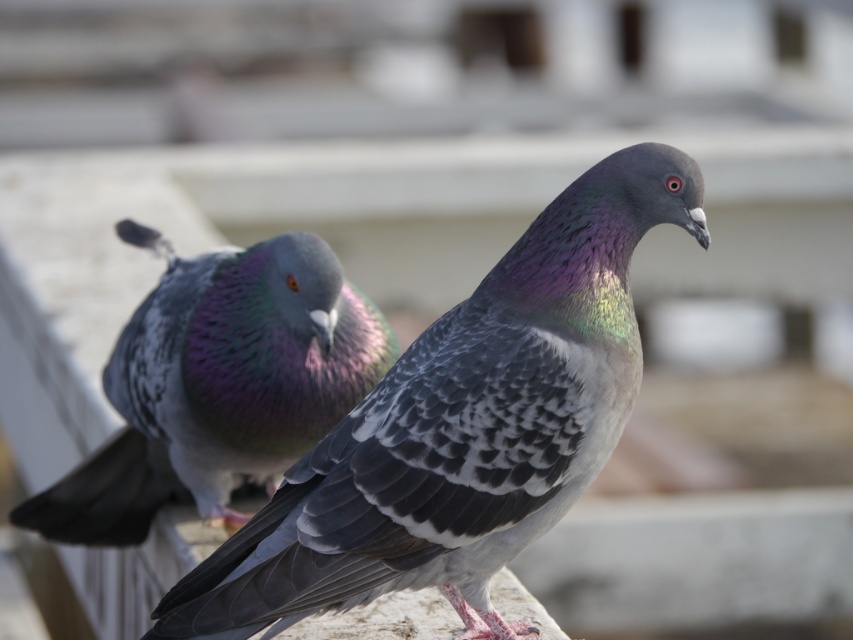
Question: Can you confirm if shiny iridescent pigeon at center is thinner than shiny iridescent feathers at center?

Choices:
 (A) no
 (B) yes

Answer: (B)

Question: Is shiny iridescent pigeon at center further to the viewer compared to shiny iridescent feathers at center?

Choices:
 (A) yes
 (B) no

Answer: (B)

Question: Is shiny iridescent pigeon at center to the left of shiny iridescent feathers at center from the viewer's perspective?

Choices:
 (A) yes
 (B) no

Answer: (B)